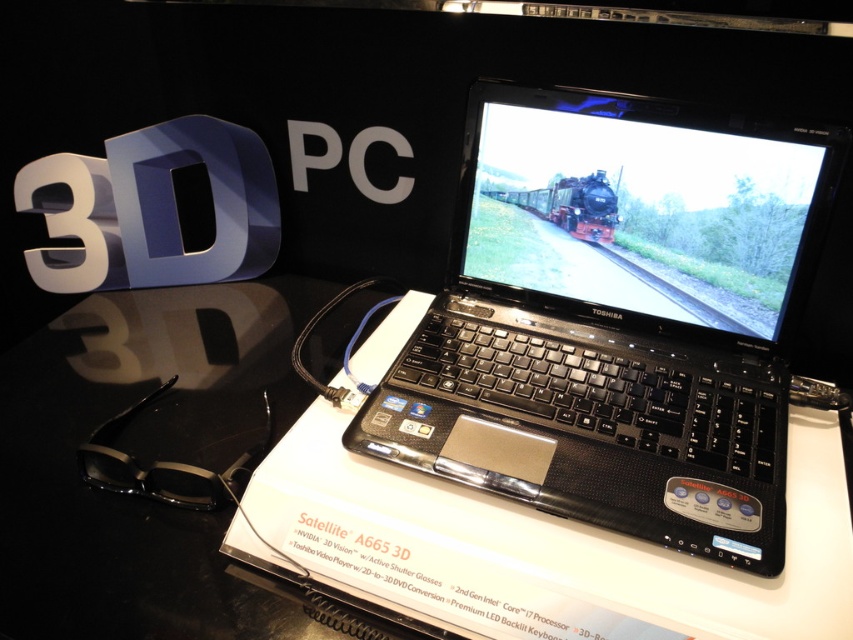
You are at a tech event and see the black glossy table at center and the matte black train at center. Which object is closer to you?

The black glossy table at center is closer to you because it is positioned under the matte black train at center, indicating it is beneath it in the spatial arrangement.

Looking at the Toshiba laptop screen displaying the steam locomotive scene, which object is positioned to the left of the other between the matte black train at center and the gray asphalt train track at center?

The matte black train at center is positioned to the left of the gray asphalt train track at center.

In the scene shown: You are setting up a display for a tech event and need to place both the black glossy table at center and the matte black train at center. Given their sizes, which object should you prioritize placing first to ensure there is enough space for both?

The black glossy table at center has a larger width than the matte black train at center, so you should prioritize placing the black glossy table at center first to ensure there is enough space for both.